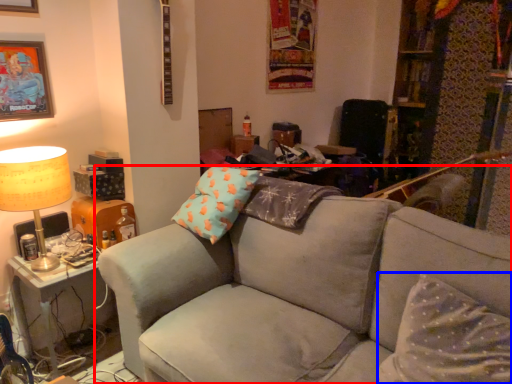
Question: Which object is closer to the camera taking this photo, studio couch (highlighted by a red box) or pillow (highlighted by a blue box)?

Choices:
 (A) studio couch
 (B) pillow

Answer: (A)